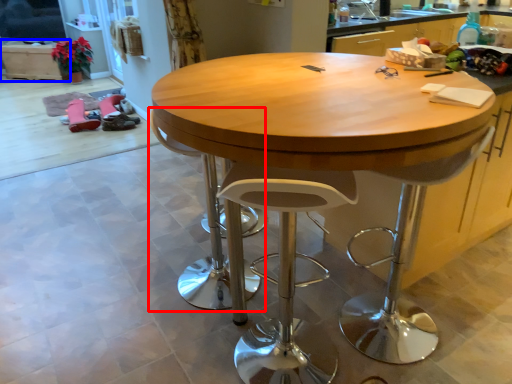
Question: Which point is further to the camera, swivel chair (highlighted by a red box) or cabinetry (highlighted by a blue box)?

Choices:
 (A) swivel chair
 (B) cabinetry

Answer: (B)